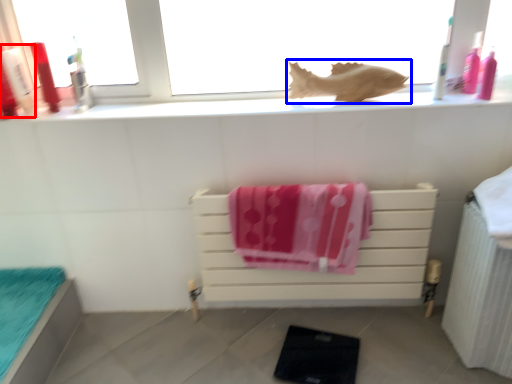
Question: Which point is further to the camera, toiletry (highlighted by a red box) or animal (highlighted by a blue box)?

Choices:
 (A) toiletry
 (B) animal

Answer: (B)